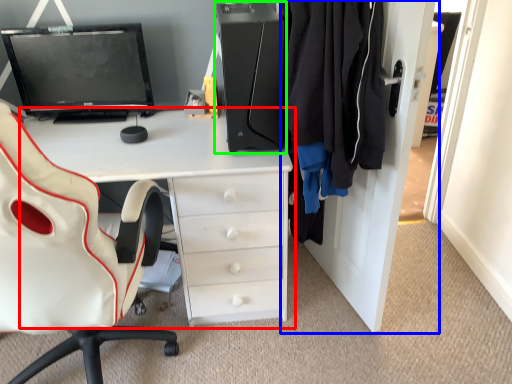
Question: Considering the real-world distances, which object is farthest from desk (highlighted by a red box)? dresser (highlighted by a blue box) or computer tower (highlighted by a green box)?

Choices:
 (A) dresser
 (B) computer tower

Answer: (A)